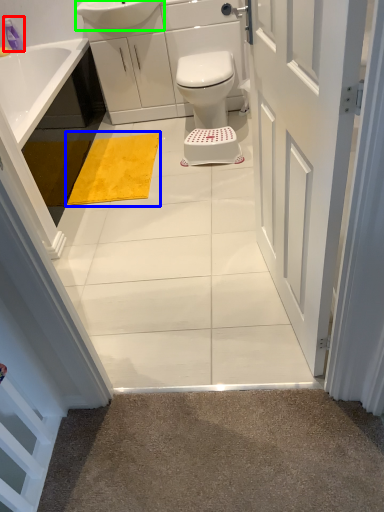
Question: Which object is positioned closest to toiletry (highlighted by a red box)? Select from bath mat (highlighted by a blue box) and sink (highlighted by a green box).

Choices:
 (A) bath mat
 (B) sink

Answer: (B)